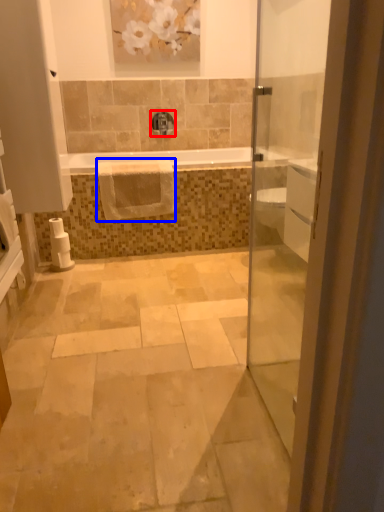
Question: Which of the following is the closest to the observer, tap (highlighted by a red box) or hand towel (highlighted by a blue box)?

Choices:
 (A) tap
 (B) hand towel

Answer: (B)